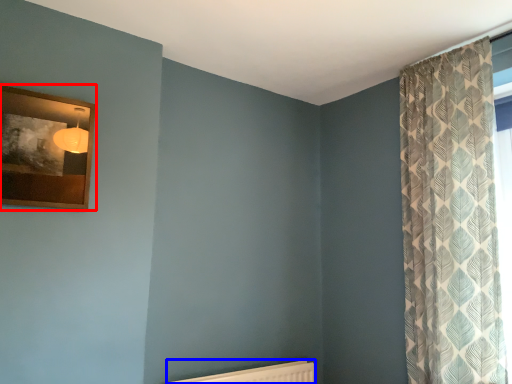
Question: Which object appears closest to the camera in this image, picture frame (highlighted by a red box) or radiator (highlighted by a blue box)?

Choices:
 (A) picture frame
 (B) radiator

Answer: (A)